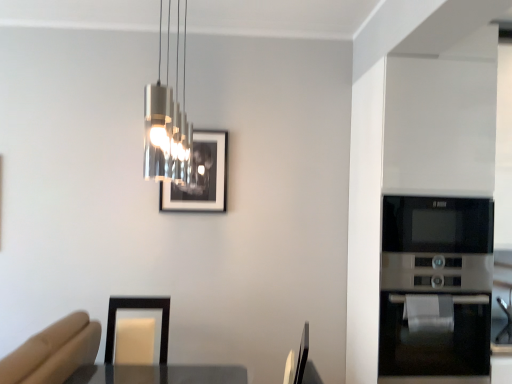
Question: Should I look upward or downward to see metallic cylindrical light fixture at upper center?

Choices:
 (A) up
 (B) down

Answer: (A)

Question: Could you tell me if metallic cylindrical light fixture at upper center is facing matte black picture frame at upper center?

Choices:
 (A) no
 (B) yes

Answer: (A)

Question: Can you confirm if metallic cylindrical light fixture at upper center is bigger than matte black picture frame at upper center?

Choices:
 (A) yes
 (B) no

Answer: (A)

Question: Would you say metallic cylindrical light fixture at upper center is a long distance from matte black picture frame at upper center?

Choices:
 (A) yes
 (B) no

Answer: (B)

Question: From the image's perspective, is metallic cylindrical light fixture at upper center above matte black picture frame at upper center?

Choices:
 (A) yes
 (B) no

Answer: (A)

Question: Considering the relative positions of metallic cylindrical light fixture at upper center and matte black picture frame at upper center in the image provided, is metallic cylindrical light fixture at upper center to the right of matte black picture frame at upper center from the viewer's perspective?

Choices:
 (A) yes
 (B) no

Answer: (A)

Question: From a real-world perspective, is metallic cylindrical light fixture at upper center located higher than matte black picture frame at upper center?

Choices:
 (A) no
 (B) yes

Answer: (B)

Question: Is black glass microwave at right bigger than metallic cylindrical light fixture at upper center?

Choices:
 (A) yes
 (B) no

Answer: (A)

Question: Is the position of black glass microwave at right less distant than that of metallic cylindrical light fixture at upper center?

Choices:
 (A) no
 (B) yes

Answer: (A)

Question: From the image's perspective, is black glass microwave at right on metallic cylindrical light fixture at upper center?

Choices:
 (A) no
 (B) yes

Answer: (A)

Question: Does black glass microwave at right have a smaller size compared to metallic cylindrical light fixture at upper center?

Choices:
 (A) yes
 (B) no

Answer: (B)

Question: From a real-world perspective, is black glass microwave at right on metallic cylindrical light fixture at upper center?

Choices:
 (A) no
 (B) yes

Answer: (A)

Question: Is black glass microwave at right looking in the opposite direction of metallic cylindrical light fixture at upper center?

Choices:
 (A) no
 (B) yes

Answer: (A)

Question: Does matte black picture frame at upper center have a lesser width compared to black glass microwave at right?

Choices:
 (A) yes
 (B) no

Answer: (A)